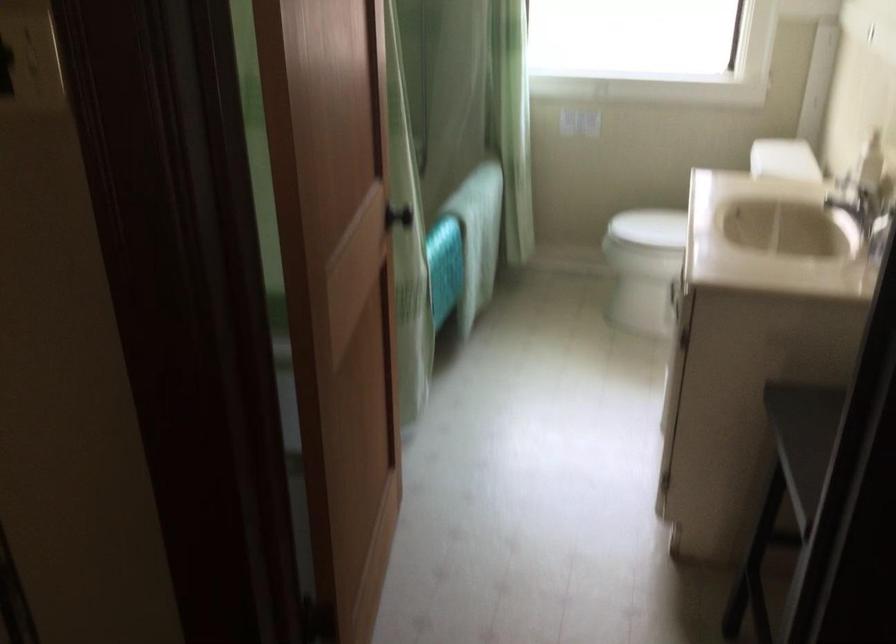
Find where to turn the faucet handle. Please return your answer as a coordinate pair (x, y).

(862, 199)